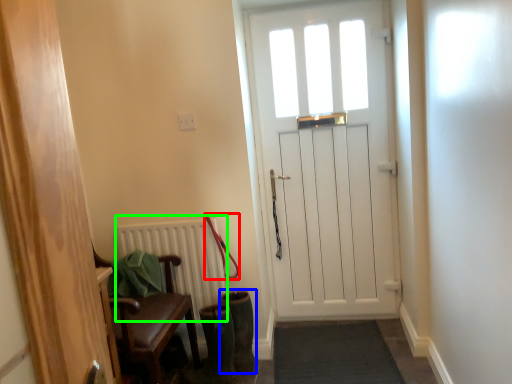
Question: Which object is the closest to the leash (highlighted by a red box)? Choose among these: boot (highlighted by a blue box) or radiator (highlighted by a green box).

Choices:
 (A) boot
 (B) radiator

Answer: (B)